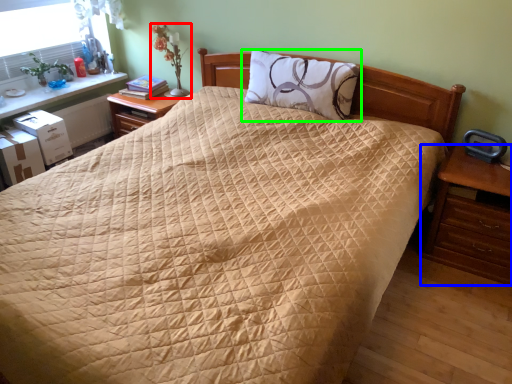
Question: Estimate the real-world distances between objects in this image. Which object is closer to table lamp (highlighted by a red box), nightstand (highlighted by a blue box) or pillow (highlighted by a green box)?

Choices:
 (A) nightstand
 (B) pillow

Answer: (B)